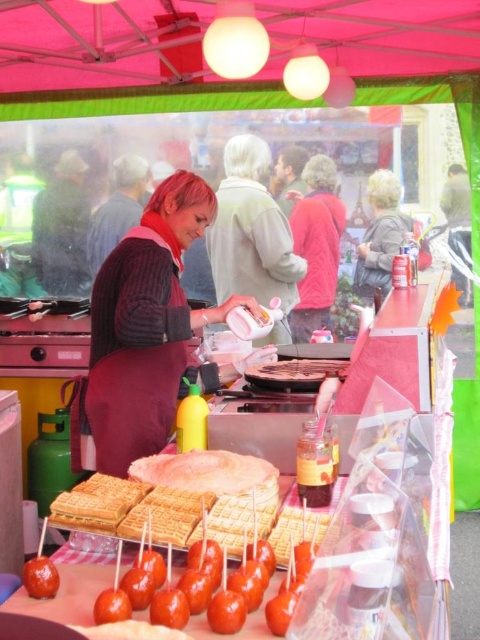
Between shiny caramel apples at center and glossy caramel apple at lower left, which one appears on the right side from the viewer's perspective?

shiny caramel apples at center is more to the right.

Does shiny caramel apples at center have a greater height compared to glossy caramel apple at lower left?

Correct, shiny caramel apples at center is much taller as glossy caramel apple at lower left.

Between point (179, 580) and point (31, 570), which one is positioned in front?

Point (179, 580) is more forward.

Where is `shiny caramel apples at center`? shiny caramel apples at center is located at coordinates (225, 609).

Does matte gray sweater at center have a lesser width compared to golden waffle at center?

No.

Which is behind, point (225, 202) or point (247, 484)?

The point (225, 202) is behind.

Identify the location of matte gray sweater at center. The width and height of the screenshot is (480, 640). (252, 234).

Is matte maroon sweater at center to the left of matte gray sweater at center from the viewer's perspective?

Indeed, matte maroon sweater at center is positioned on the left side of matte gray sweater at center.

Looking at this image, is matte maroon sweater at center below matte gray sweater at center?

Indeed, matte maroon sweater at center is positioned under matte gray sweater at center.

Identify the location of matte maroon sweater at center. (144, 332).